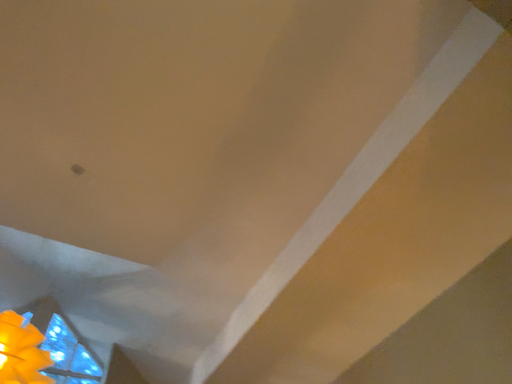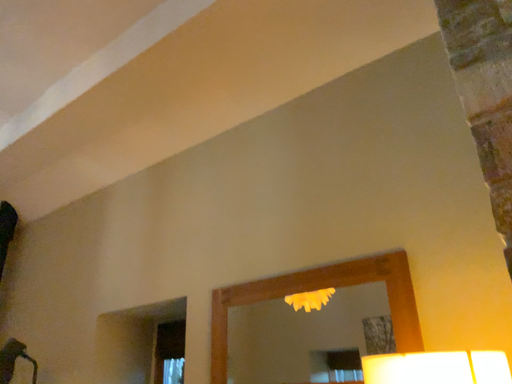
Question: How did the camera likely rotate when shooting the video?

Choices:
 (A) rotated left
 (B) rotated right

Answer: (B)